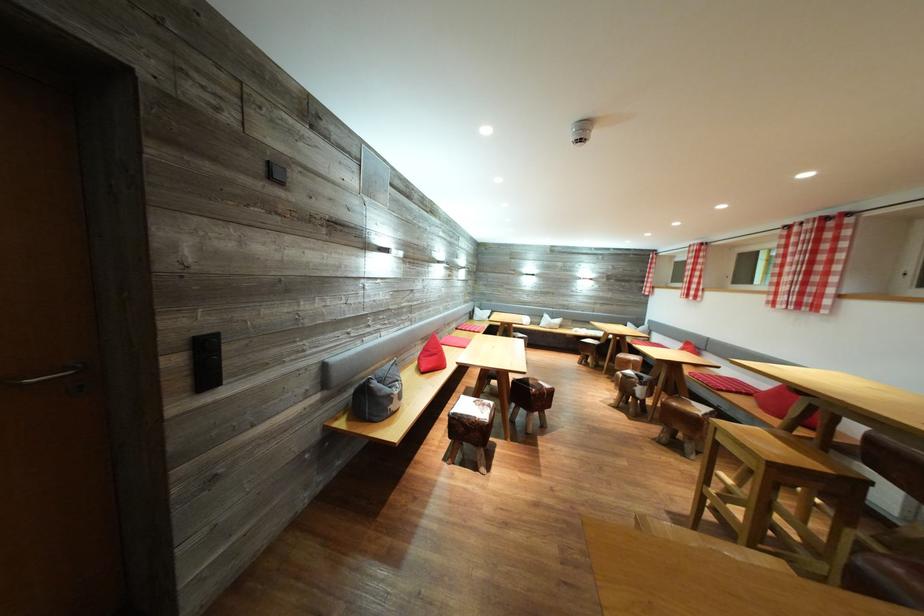
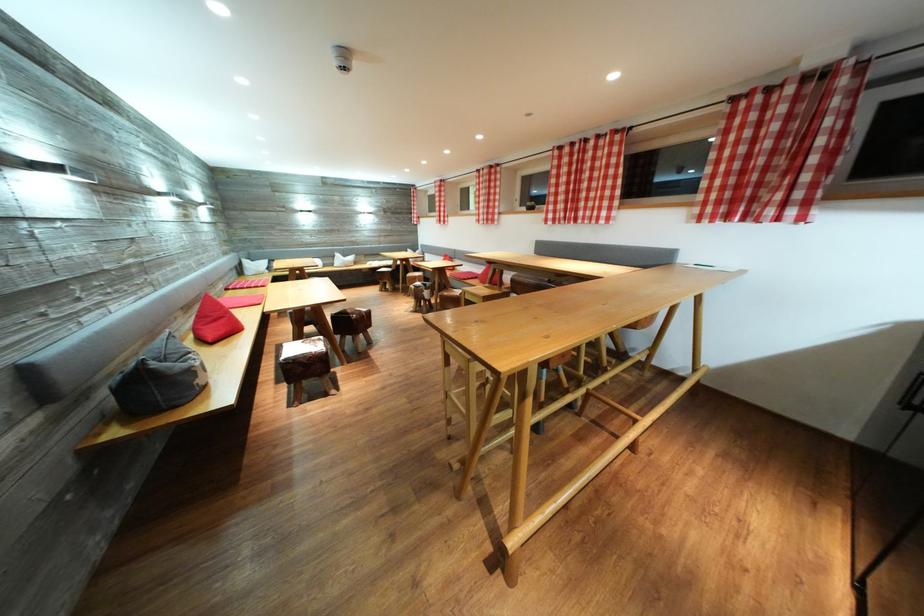
Find the pixel in the second image that matches pixel 394 395 in the first image.

(187, 371)